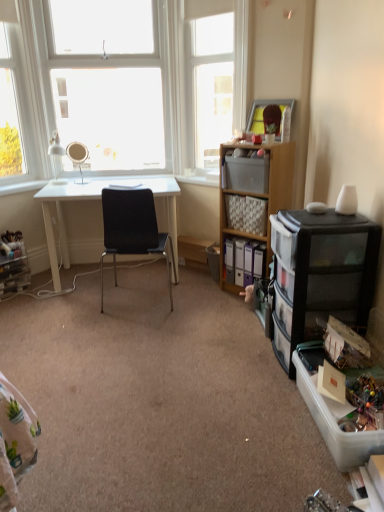
You are a GUI agent. You are given a task and a screenshot of the screen. Output one action in this format:
    pyautogui.click(x=<x>, y=<y>)
    Task: Click on the free space in front of wooden cabinet at center right, arranged as the first cabinetry when viewed from the back
    The image size is (384, 512).
    Given the screenshot: What is the action you would take?
    pyautogui.click(x=233, y=313)